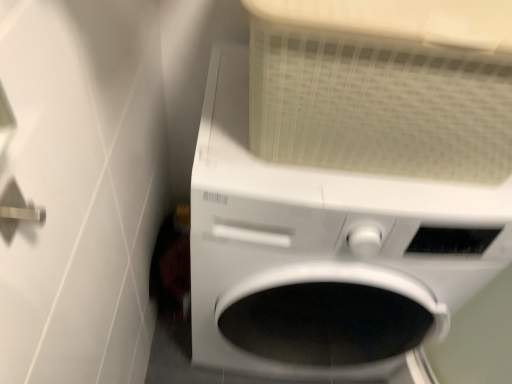
The image size is (512, 384). What do you see at coordinates (16, 211) in the screenshot? I see `silver metallic door handle at upper left` at bounding box center [16, 211].

Image resolution: width=512 pixels, height=384 pixels. I want to click on silver metallic door handle at upper left, so click(x=16, y=211).

What do you see at coordinates (349, 182) in the screenshot?
I see `white matte washing machine at center` at bounding box center [349, 182].

Measure the distance between point (x=346, y=43) and camera.

A distance of 49.10 centimeters exists between point (x=346, y=43) and camera.

The image size is (512, 384). What are the coordinates of `white matte washing machine at center` in the screenshot? It's located at (349, 182).

You are a GUI agent. You are given a task and a screenshot of the screen. Output one action in this format:
    pyautogui.click(x=<x>, y=<y>)
    Task: Click on the silver metallic door handle at upper left
    This screenshot has height=384, width=512.
    Given the screenshot: What is the action you would take?
    pyautogui.click(x=16, y=211)

Considering the relative positions of silver metallic door handle at upper left and white matte washing machine at center in the image provided, is silver metallic door handle at upper left to the left of white matte washing machine at center from the viewer's perspective?

Yes.

Does silver metallic door handle at upper left lie behind white matte washing machine at center?

No, silver metallic door handle at upper left is in front of white matte washing machine at center.

Considering the positions of point (9, 217) and point (289, 140), is point (9, 217) closer or farther from the camera than point (289, 140)?

Clearly, point (9, 217) is closer to the camera than point (289, 140).

Looking at this image, from the image's perspective, is silver metallic door handle at upper left under white matte washing machine at center?

No.

From a real-world perspective, who is located lower, silver metallic door handle at upper left or white matte washing machine at center?

white matte washing machine at center.

Looking at this image, which object is thinner, silver metallic door handle at upper left or white matte washing machine at center?

silver metallic door handle at upper left is thinner.

Which of these two, silver metallic door handle at upper left or white matte washing machine at center, stands taller?

Standing taller between the two is white matte washing machine at center.

Which of these two, silver metallic door handle at upper left or white matte washing machine at center, is bigger?

Bigger between the two is white matte washing machine at center.

Is white matte washing machine at center a part of silver metallic door handle at upper left?

No, white matte washing machine at center is located outside of silver metallic door handle at upper left.

Is silver metallic door handle at upper left far away from white matte washing machine at center?

No.

Could you tell me if silver metallic door handle at upper left is turned towards white matte washing machine at center?

No, silver metallic door handle at upper left is not aimed at white matte washing machine at center.

Can you tell me how much silver metallic door handle at upper left and white matte washing machine at center differ in facing direction?

The angular difference between silver metallic door handle at upper left and white matte washing machine at center is 89.1 degrees.

How far apart are silver metallic door handle at upper left and white matte washing machine at center?

silver metallic door handle at upper left is 55.70 centimeters from white matte washing machine at center.

What are the coordinates of `washing machine lying behind the silver metallic door handle at upper left` in the screenshot? It's located at (349, 182).

Is white matte washing machine at center to the right of silver metallic door handle at upper left from the viewer's perspective?

Correct, you'll find white matte washing machine at center to the right of silver metallic door handle at upper left.

Is white matte washing machine at center in front of or behind silver metallic door handle at upper left in the image?

In the image, white matte washing machine at center appears behind silver metallic door handle at upper left.

Between point (407, 211) and point (21, 204), which one is positioned in front?

Point (21, 204)

Consider the image. From the image's perspective, who appears lower, white matte washing machine at center or silver metallic door handle at upper left?

From the image's view, white matte washing machine at center is below.

From a real-world perspective, who is located higher, white matte washing machine at center or silver metallic door handle at upper left?

Answer: silver metallic door handle at upper left is physically above.

Can you confirm if white matte washing machine at center is wider than silver metallic door handle at upper left?

Correct, the width of white matte washing machine at center exceeds that of silver metallic door handle at upper left.

Considering the relative sizes of white matte washing machine at center and silver metallic door handle at upper left in the image provided, is white matte washing machine at center taller than silver metallic door handle at upper left?

Correct, white matte washing machine at center is much taller as silver metallic door handle at upper left.

From the picture: Which of these two, white matte washing machine at center or silver metallic door handle at upper left, is smaller?

silver metallic door handle at upper left.

Is white matte washing machine at center located outside silver metallic door handle at upper left?

white matte washing machine at center is positioned outside silver metallic door handle at upper left.

Does white matte washing machine at center touch silver metallic door handle at upper left?

They are not placed beside each other.

Does white matte washing machine at center turn towards silver metallic door handle at upper left?

No, white matte washing machine at center is not turned towards silver metallic door handle at upper left.

This screenshot has width=512, height=384. I want to click on door handle in front of the white matte washing machine at center, so pyautogui.click(x=16, y=211).

Locate an element on the screen. The height and width of the screenshot is (384, 512). door handle above the white matte washing machine at center (from the image's perspective) is located at coordinates (16, 211).

Locate an element on the screen. washing machine below the silver metallic door handle at upper left (from the image's perspective) is located at coordinates (349, 182).